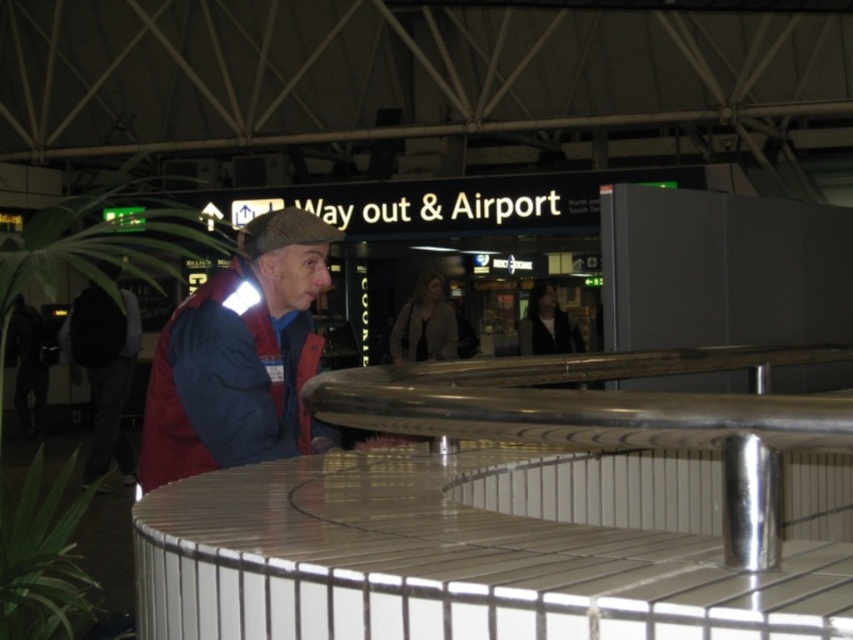
You are standing at the entrance of the station and see two jackets in the scene. The matte red jacket at center and the dark blue jacket at center. Which one is positioned to the right side?

The matte red jacket at center is positioned to the right of the dark blue jacket at center.

You are a fashion designer observing people in the station. You notice two jackets, the matte red jacket at center and the dark blue jacket at center. Which jacket appears to be shorter in length?

The matte red jacket at center is shorter than the dark blue jacket at center.

You are standing in the station and want to walk towards the point that is closer to you. Which point should you walk towards, point (320,426) or point (99,429)?

You should walk towards point (320,426) because it is closer to the viewer than point (99,429).